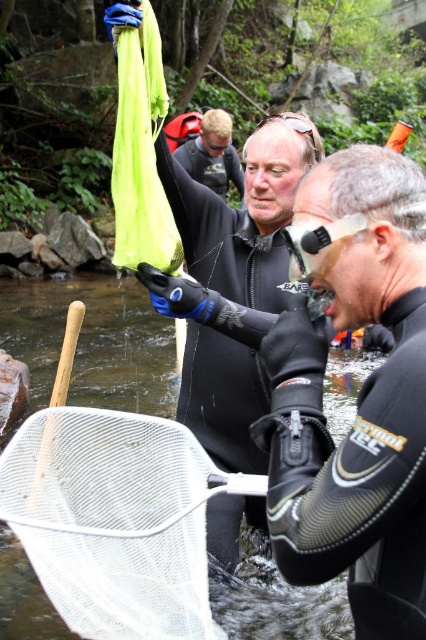
Question: Can you confirm if black neoprene wetsuit at center is positioned to the right of black wetsuit at center?

Choices:
 (A) yes
 (B) no

Answer: (A)

Question: Which point appears closest to the camera in this image?

Choices:
 (A) (365, 515)
 (B) (221, 145)

Answer: (A)

Question: From the image, what is the correct spatial relationship of black neoprene wetsuit at center in relation to black wetsuit at center?

Choices:
 (A) right
 (B) left

Answer: (A)

Question: Is black neoprene wetsuit at center above black wetsuit at center?

Choices:
 (A) no
 (B) yes

Answer: (A)